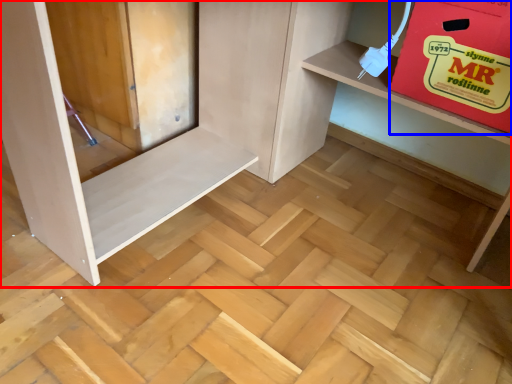
Question: Which of the following is the closest to the observer, furniture (highlighted by a red box) or cardboard box (highlighted by a blue box)?

Choices:
 (A) furniture
 (B) cardboard box

Answer: (A)